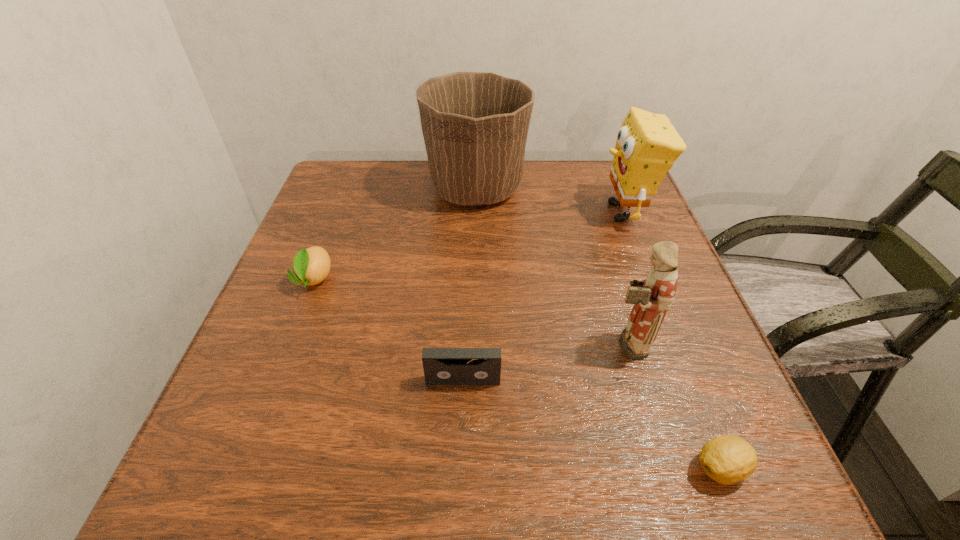
You are a GUI agent. You are given a task and a screenshot of the screen. Output one action in this format:
    pyautogui.click(x=<x>, y=<y>)
    Task: Click on the vacant area between the nearest object and the sponge
    
    Given the screenshot: What is the action you would take?
    pyautogui.click(x=672, y=340)

Locate an element on the screen. free space between the nearest object and the figurine is located at coordinates (674, 406).

Locate an element on the screen. free point between the flowerpot and the second nearest object is located at coordinates (469, 285).

This screenshot has height=540, width=960. I want to click on object that stands as the fifth closest to the figurine, so click(x=312, y=265).

Locate which object is the fifth closest to the sponge. Please provide its 2D coordinates. Your answer should be formatted as a tuple, i.e. [(x, y)], where the tuple contains the x and y coordinates of a point satisfying the conditions above.

[(312, 265)]

Identify the location of free point that satisfies the following two spatial constraints: 1. on the face of the sponge; 2. with leaves positioned above the farther lemon. The width and height of the screenshot is (960, 540). (650, 279).

Identify the location of free region that satisfies the following two spatial constraints: 1. on the front-facing side of the figurine; 2. on the front-facing side of the fifth farthest object. (636, 380).

Where is `blank area in the image that satisfies the following two spatial constraints: 1. on the front-facing side of the figurine; 2. on the front-facing side of the videotape`? This screenshot has height=540, width=960. blank area in the image that satisfies the following two spatial constraints: 1. on the front-facing side of the figurine; 2. on the front-facing side of the videotape is located at coordinates 636,380.

Where is `vacant region that satisfies the following two spatial constraints: 1. on the face of the sponge; 2. with leaves positioned above the farther lemon`? The width and height of the screenshot is (960, 540). vacant region that satisfies the following two spatial constraints: 1. on the face of the sponge; 2. with leaves positioned above the farther lemon is located at coordinates (650, 279).